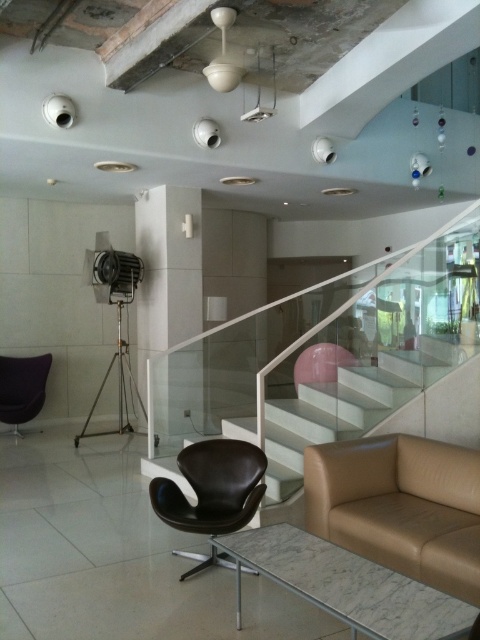
Does black leather chair at center appear on the right side of velvet black chair at left?

Indeed, black leather chair at center is positioned on the right side of velvet black chair at left.

What do you see at coordinates (213, 486) in the screenshot? Image resolution: width=480 pixels, height=640 pixels. I see `black leather chair at center` at bounding box center [213, 486].

Is point (196, 442) closer to viewer compared to point (1, 420)?

Yes, point (196, 442) is closer to viewer.

This screenshot has height=640, width=480. Find the location of `black leather chair at center`. black leather chair at center is located at coordinates 213,486.

Can you confirm if tan leather couch at lower right is taller than black leather chair at center?

No.

Who is positioned more to the left, tan leather couch at lower right or black leather chair at center?

black leather chair at center is more to the left.

Locate an element on the screen. This screenshot has width=480, height=640. tan leather couch at lower right is located at coordinates (400, 506).

Identify the location of tan leather couch at lower right. This screenshot has width=480, height=640. (400, 506).

Is point (460, 579) farther from viewer compared to point (3, 371)?

No, it is not.

Is tan leather couch at lower right shorter than velvet black chair at left?

Indeed, tan leather couch at lower right has a lesser height compared to velvet black chair at left.

Does point (420, 472) come in front of point (16, 429)?

Yes, point (420, 472) is in front of point (16, 429).

Identify the location of tan leather couch at lower right. The height and width of the screenshot is (640, 480). (400, 506).